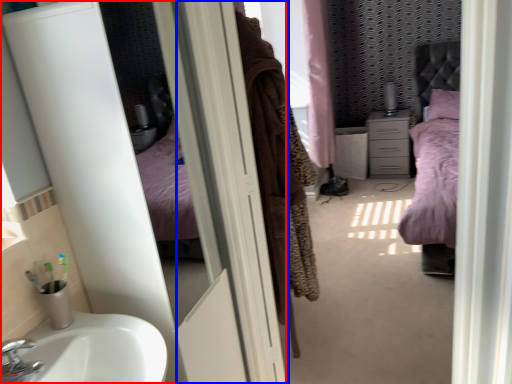
Question: Which of the following is the farthest to the observer, screen door (highlighted by a red box) or screen door (highlighted by a blue box)?

Choices:
 (A) screen door
 (B) screen door

Answer: (B)